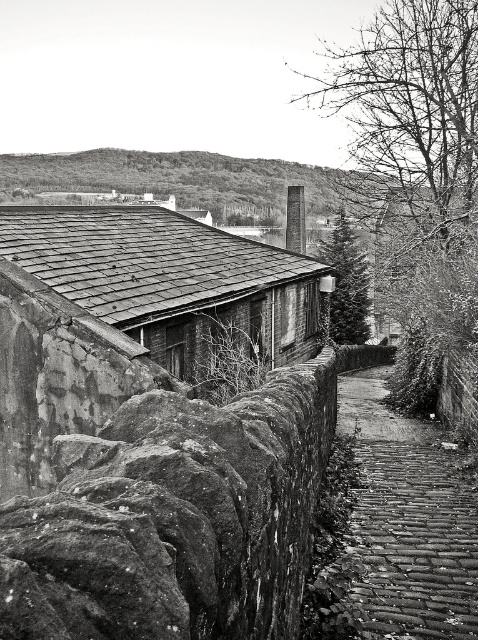
Question: Among these points, which one is nearest to the camera?

Choices:
 (A) (462, 28)
 (B) (96, 336)

Answer: (B)

Question: Does rough stone wall at lower left come in front of green textured pine tree at center?

Choices:
 (A) no
 (B) yes

Answer: (B)

Question: Is wooden shingles hut at center to the left of rustic cobblestone path at center from the viewer's perspective?

Choices:
 (A) yes
 (B) no

Answer: (A)

Question: Which point appears closest to the camera in this image?

Choices:
 (A) (21, 500)
 (B) (133, 339)
 (C) (448, 104)

Answer: (A)

Question: Is rough stone wall at lower left bigger than rustic cobblestone path at center?

Choices:
 (A) no
 (B) yes

Answer: (A)

Question: Among these objects, which one is farthest from the camera?

Choices:
 (A) bare branches at upper right
 (B) wooden shingles hut at center
 (C) green textured pine tree at center

Answer: (C)